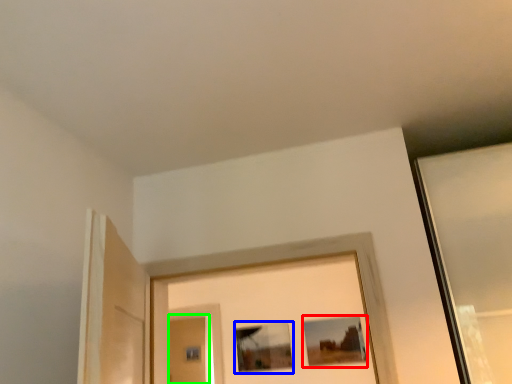
Question: Which object is positioned closest to picture frame (highlighted by a red box)? Select from picture frame (highlighted by a blue box) and screen door (highlighted by a green box).

Choices:
 (A) picture frame
 (B) screen door

Answer: (A)